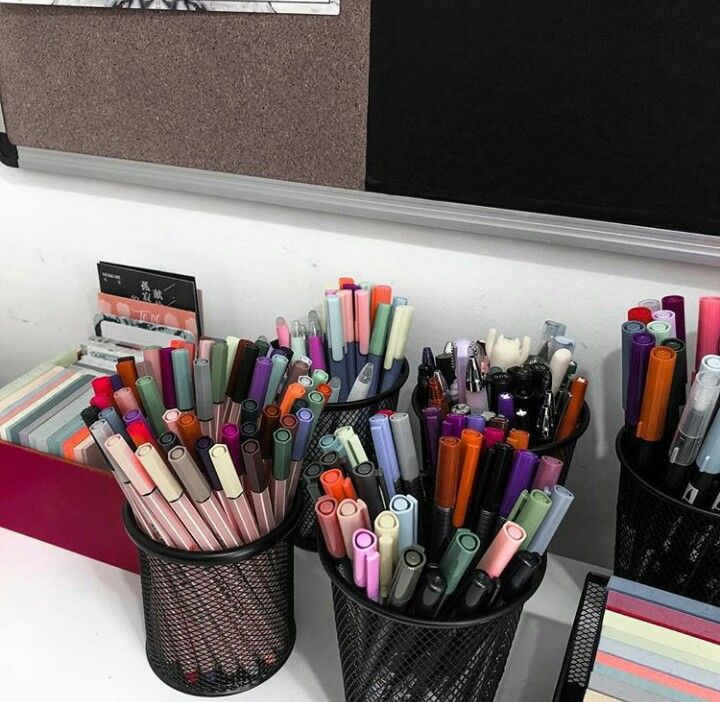
In order to click on corner of aluminium frame in this screenshot , I will do `click(9, 152)`.